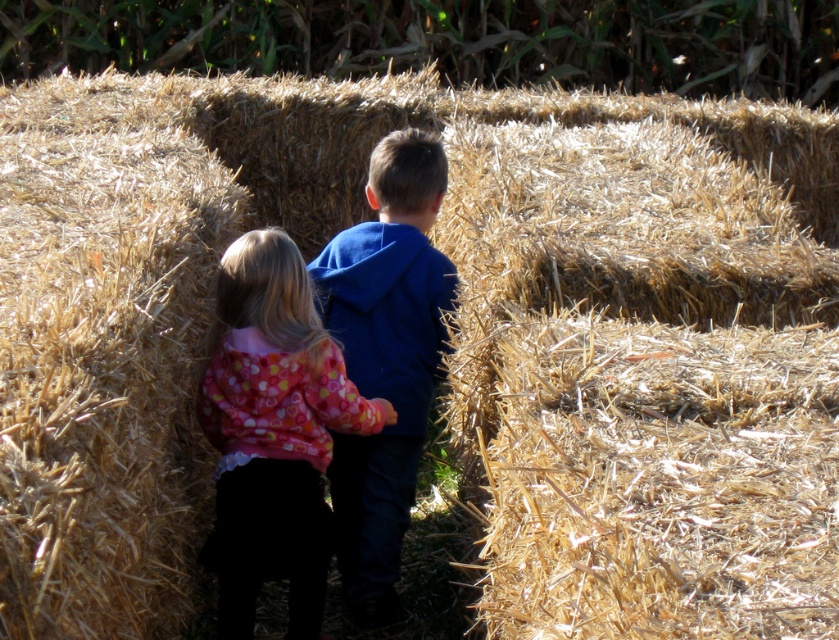
Question: In this image, where is floral fleece jacket at center located relative to blue fleece jacket at center?

Choices:
 (A) above
 (B) below

Answer: (B)

Question: Can you confirm if floral fleece jacket at center is wider than blue fleece jacket at center?

Choices:
 (A) no
 (B) yes

Answer: (B)

Question: Among these objects, which one is farthest from the camera?

Choices:
 (A) blue fleece jacket at center
 (B) floral fleece jacket at center

Answer: (A)

Question: In this image, where is floral fleece jacket at center located relative to blue fleece jacket at center?

Choices:
 (A) below
 (B) above

Answer: (A)